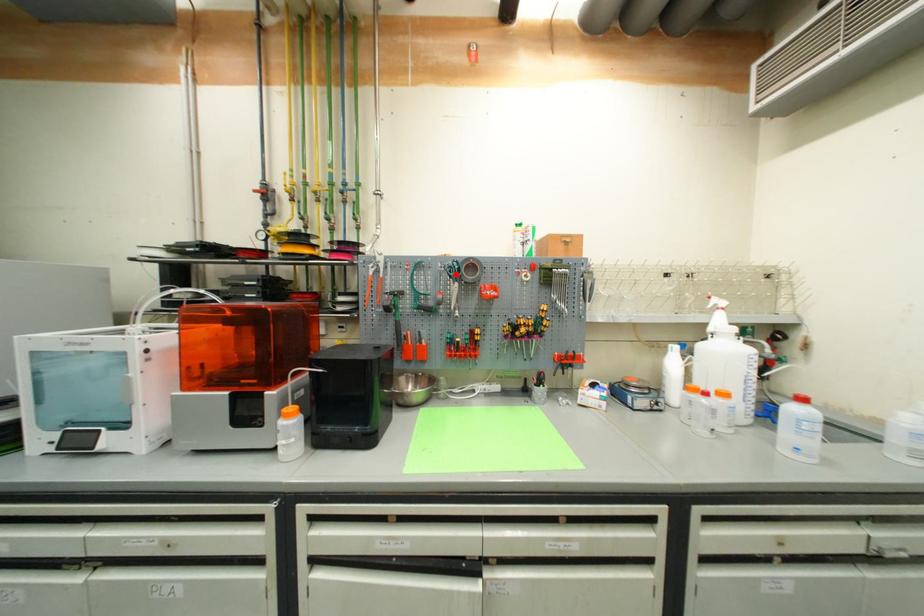
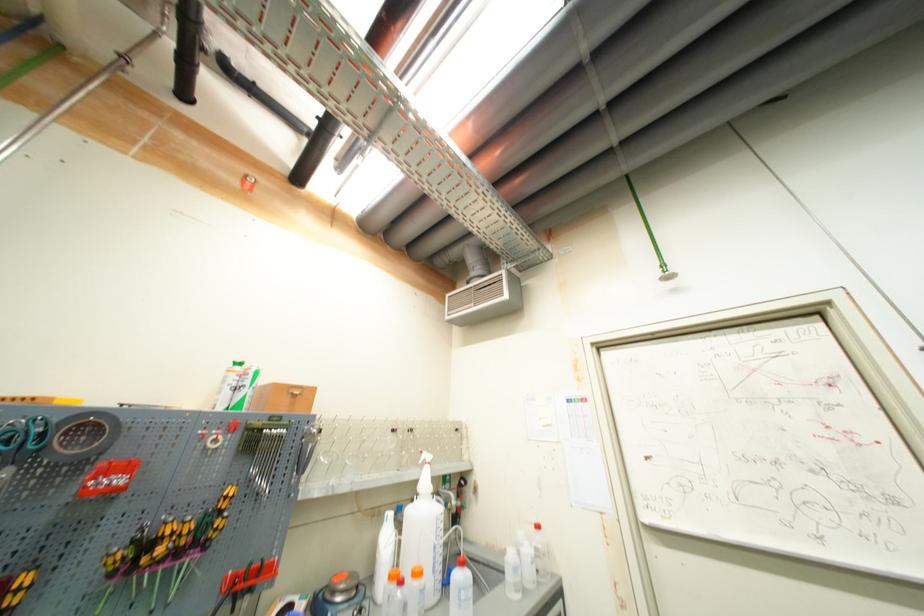
The point at the highlighted location is marked in the first image. Where is the corresponding point in the second image?

(14, 445)